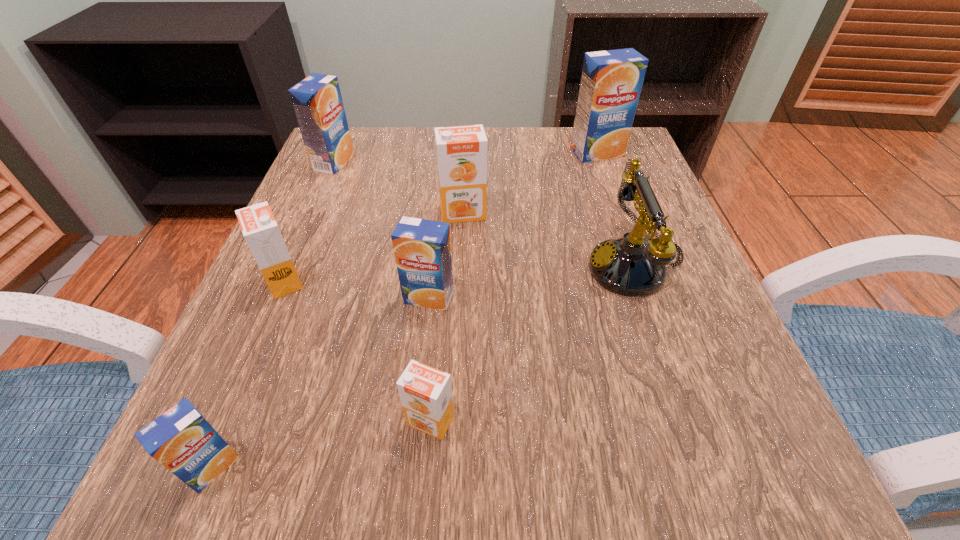
Identify the location of vacant space located on the right of the smallest orange orange juice. This screenshot has height=540, width=960. (500, 421).

Where is `free point located on the back of the nearest blue orange_juice`? The width and height of the screenshot is (960, 540). free point located on the back of the nearest blue orange_juice is located at coordinates (290, 279).

Find the location of `orange_juice present at the right edge`. orange_juice present at the right edge is located at coordinates (611, 81).

Image resolution: width=960 pixels, height=540 pixels. What are the coordinates of `telephone that is positioned at the right edge` in the screenshot? It's located at (629, 266).

You are a GUI agent. You are given a task and a screenshot of the screen. Output one action in this format:
    pyautogui.click(x=<x>, y=<y>)
    Task: Click on the object positioned at the far left corner
    The image size is (960, 540).
    Given the screenshot: What is the action you would take?
    pyautogui.click(x=317, y=101)

At what (x,y) coordinates should I click in order to perform the action: click on object located in the near left corner section of the desktop. Please return your answer as a coordinate pair (x, y). This screenshot has width=960, height=540. Looking at the image, I should click on 181,439.

I want to click on object located in the far right corner section of the desktop, so click(x=611, y=81).

Where is `vacant space at the far edge of the desktop`? Image resolution: width=960 pixels, height=540 pixels. vacant space at the far edge of the desktop is located at coordinates (429, 152).

In the image, there is a desktop. Where is `free region at the near edge`? This screenshot has height=540, width=960. free region at the near edge is located at coordinates (591, 470).

Find the location of a particular element. free spot at the left edge of the desktop is located at coordinates (331, 195).